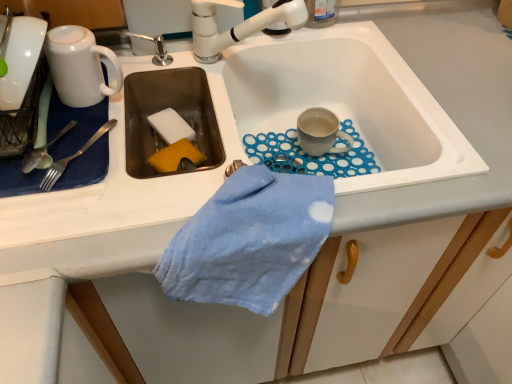
Where is `vacant area that is situated to the right of shiny silver fork at left, which is counted as the 3th silverware, starting from the right`? The width and height of the screenshot is (512, 384). vacant area that is situated to the right of shiny silver fork at left, which is counted as the 3th silverware, starting from the right is located at coordinates (138, 182).